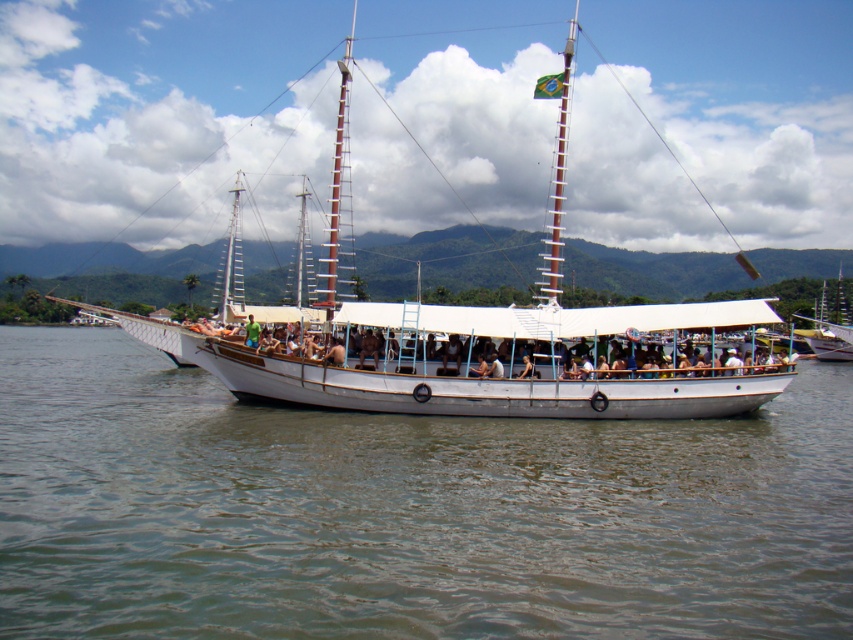
Question: Which point is closer to the camera taking this photo?

Choices:
 (A) (639, 394)
 (B) (375, 544)

Answer: (B)

Question: Can you confirm if clear water at center is wider than white wooden boat at center?

Choices:
 (A) no
 (B) yes

Answer: (A)

Question: Is clear water at center to the right of white wooden boat at center from the viewer's perspective?

Choices:
 (A) yes
 (B) no

Answer: (B)

Question: Can you confirm if clear water at center is smaller than white wooden boat at center?

Choices:
 (A) no
 (B) yes

Answer: (B)

Question: Which object appears closest to the camera in this image?

Choices:
 (A) white wooden boat at center
 (B) clear water at center

Answer: (B)